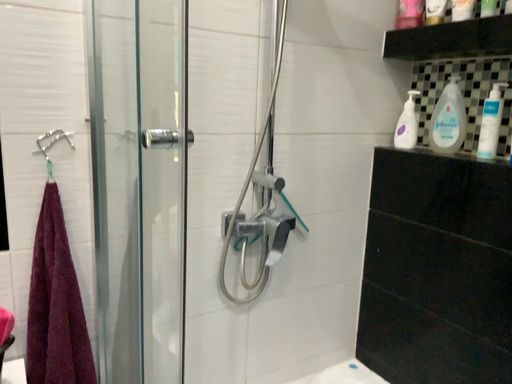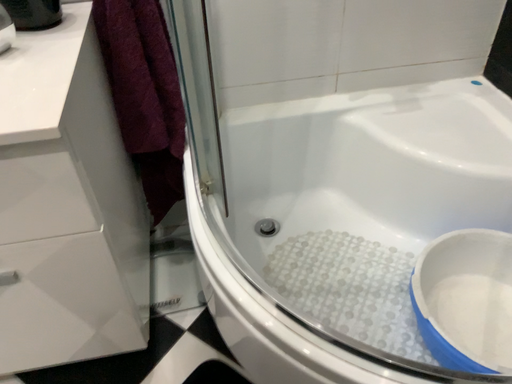
Question: How did the camera likely rotate when shooting the video?

Choices:
 (A) rotated upward
 (B) rotated downward

Answer: (B)